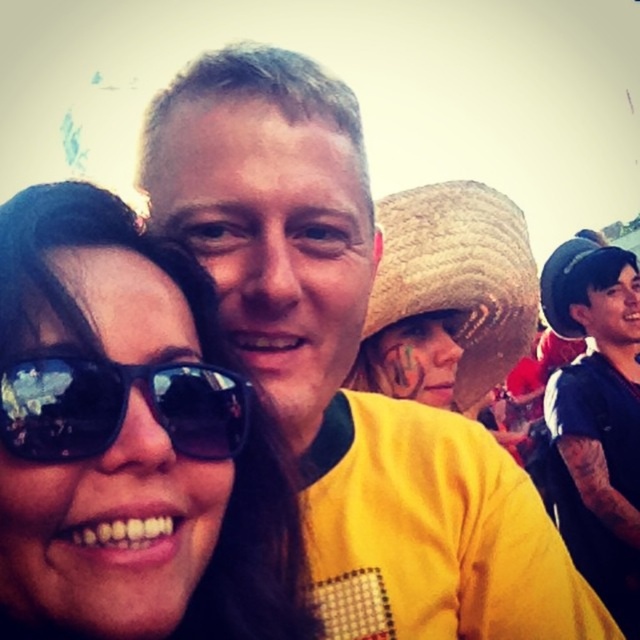
Is point (388, 332) closer to viewer compared to point (616, 324)?

Yes, it is.

Identify the location of woven straw hat at center. (448, 296).

This screenshot has width=640, height=640. Identify the location of woven straw hat at center. 448,296.

Locate an element on the screen. The height and width of the screenshot is (640, 640). matte black sunglasses at center is located at coordinates (129, 442).

Is point (209, 588) closer to viewer compared to point (620, 548)?

That is True.

Find the location of `matte black sunglasses at center`. matte black sunglasses at center is located at coordinates (129, 442).

Locate an element on the screen. This screenshot has height=640, width=640. matte black sunglasses at center is located at coordinates (129, 442).